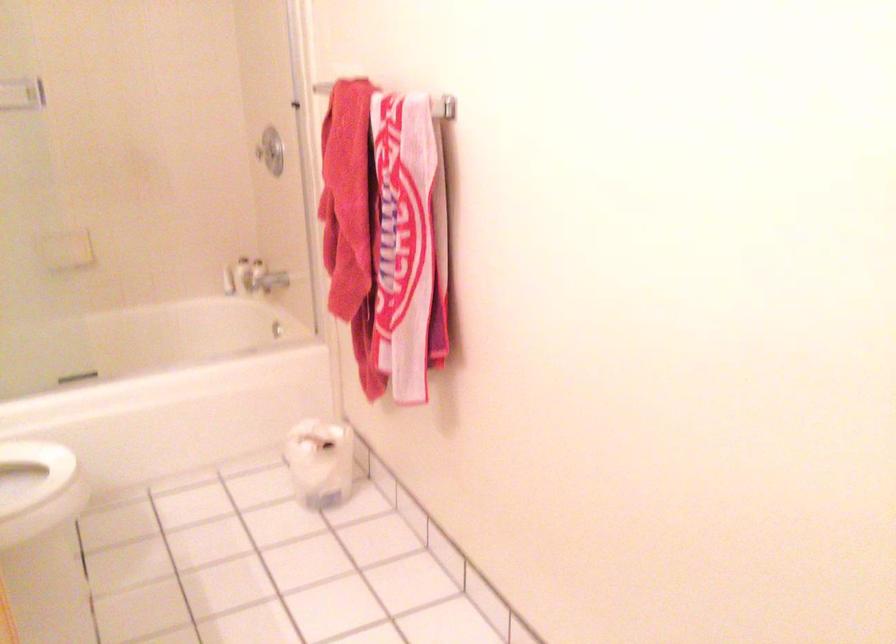
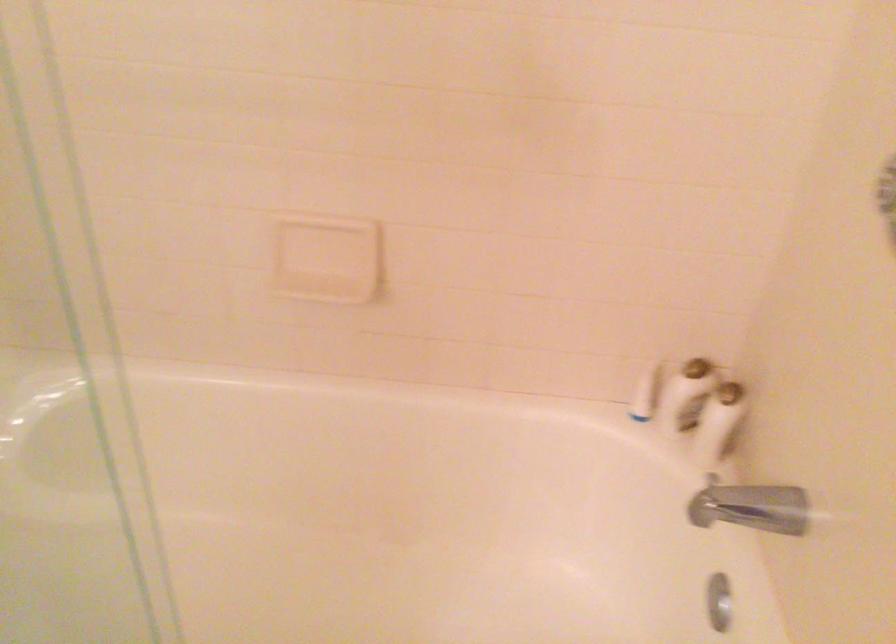
Find the pixel in the second image that matches [257,270] in the first image.

(718, 422)